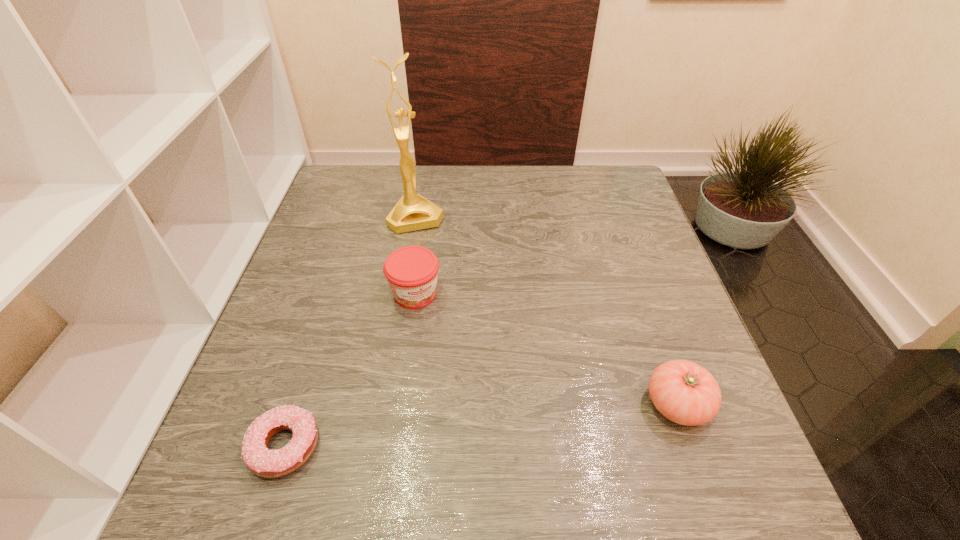
This screenshot has width=960, height=540. In order to click on vacant space located on the label side of the third nearest object in this screenshot , I will do `click(482, 406)`.

Image resolution: width=960 pixels, height=540 pixels. I want to click on vacant space located 0.370m on the front-facing side of the farthest object, so click(463, 341).

Identify the location of vacant point located on the front-facing side of the farthest object. (443, 288).

This screenshot has height=540, width=960. What are the coordinates of `free space located on the front-facing side of the farthest object` in the screenshot? It's located at (442, 285).

You are a GUI agent. You are given a task and a screenshot of the screen. Output one action in this format:
    pyautogui.click(x=<x>, y=<y>)
    Task: Click on the object at the far edge
    Image resolution: width=960 pixels, height=540 pixels.
    Given the screenshot: What is the action you would take?
    pyautogui.click(x=413, y=212)

Where is `doughnut that is at the near edge`? This screenshot has width=960, height=540. doughnut that is at the near edge is located at coordinates (263, 462).

Locate an element on the screen. This screenshot has height=540, width=960. tomato that is at the near edge is located at coordinates (684, 392).

In order to click on object located in the left edge section of the desktop in this screenshot , I will do `click(263, 462)`.

Locate an element on the screen. This screenshot has height=540, width=960. object that is at the right edge is located at coordinates click(684, 392).

Find the location of `object present at the near left corner`. object present at the near left corner is located at coordinates (263, 462).